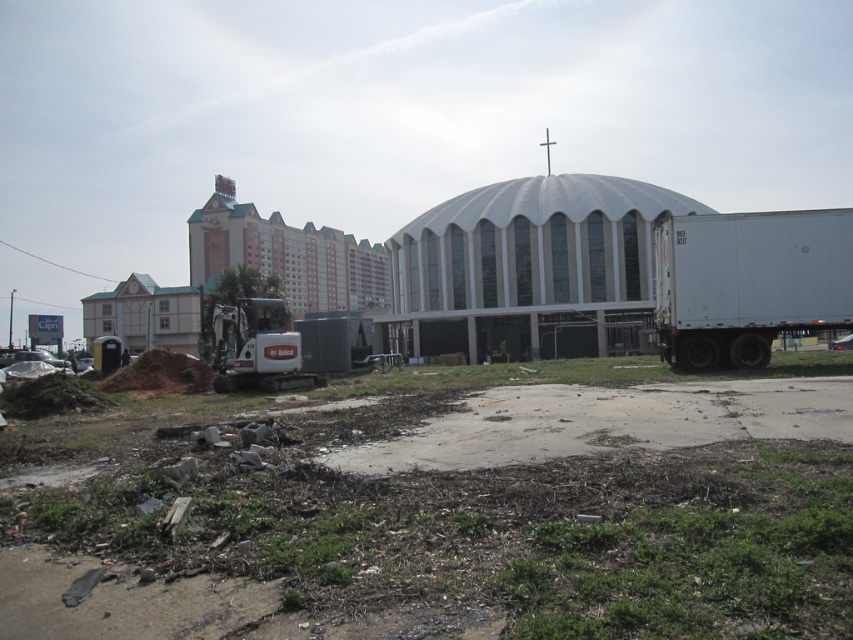
From the picture: You are a construction worker standing at the center of the image. You need to move the dirt at lower left to a new location. Based on its current position, which direction should you move it to reach the nearest edge of the image?

The dirt at lower left is located at point (440, 524). To reach the nearest edge of the image, you should move it towards the right direction since the x coordinate 0.820 is closer to the right edge than the left edge.

You are a delivery driver who needs to park your truck in this area. You see the white matte trailer truck at right and the white matte trailer truck at lower left. Which one is larger in size?

The white matte trailer truck at right is bigger than the white matte trailer truck at lower left.

You are a delivery driver who needs to park your truck without blocking the construction site entrance. The entrance is located between the dirt at lower left and the white matte trailer truck at lower left. Based on their positions, which side of the entrance should you park your truck to avoid blocking it?

The dirt at lower left is to the right of the white matte trailer truck at lower left. To avoid blocking the entrance, you should park your truck to the left side of the entrance, which is near the white matte trailer truck at lower left, since the entrance is between them and the dirt is positioned further right.